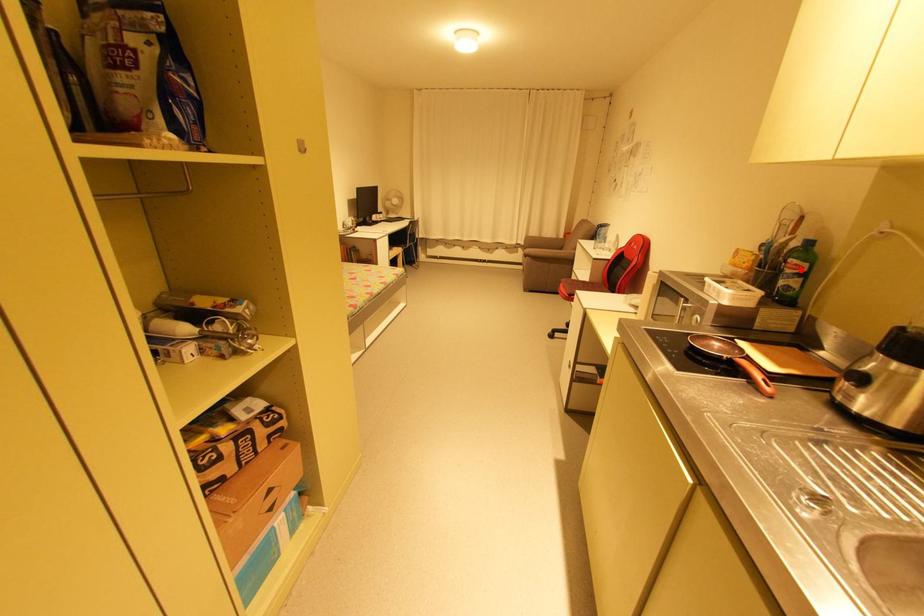
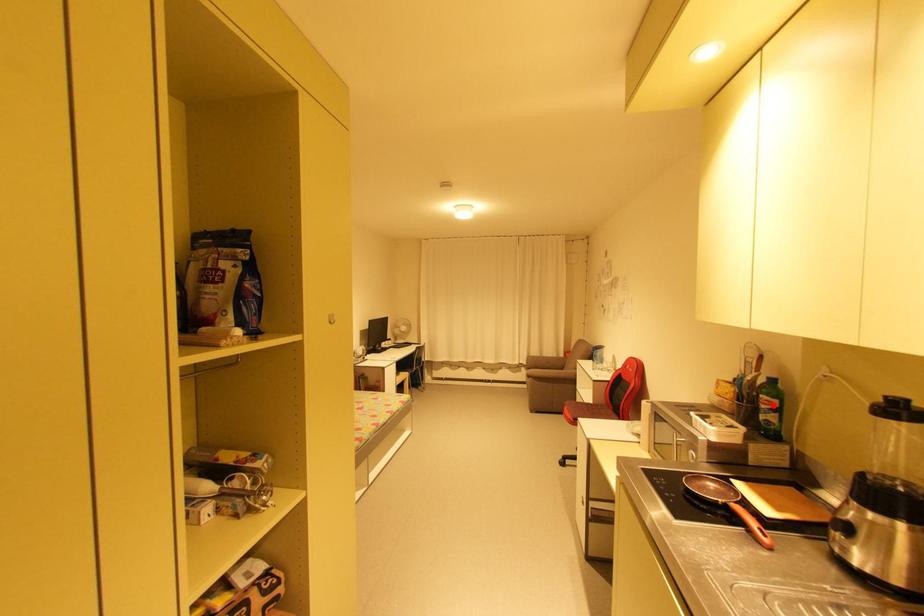
I am providing you with two images of the same scene from different viewpoints. A red point is marked on the first image and another point is marked on the second image. Are the points marked in image1 and image2 representing the same 3D position?

Yes